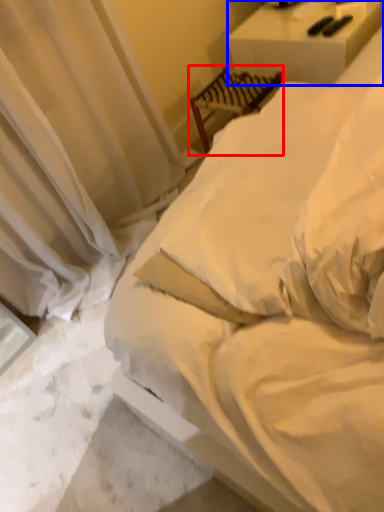
Question: Among these objects, which one is nearest to the camera, furniture (highlighted by a red box) or furniture (highlighted by a blue box)?

Choices:
 (A) furniture
 (B) furniture

Answer: (B)